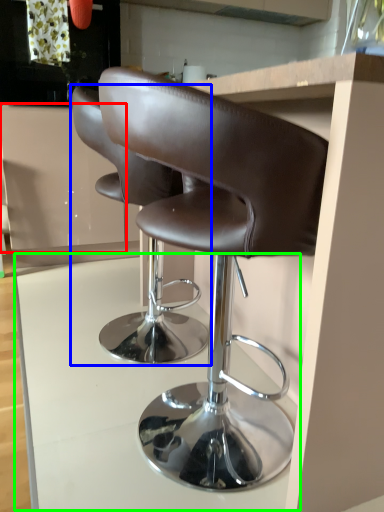
Question: Which object is positioned closest to cabinetry (highlighted by a red box)? Select from chair (highlighted by a blue box) and table (highlighted by a green box).

Choices:
 (A) chair
 (B) table

Answer: (B)